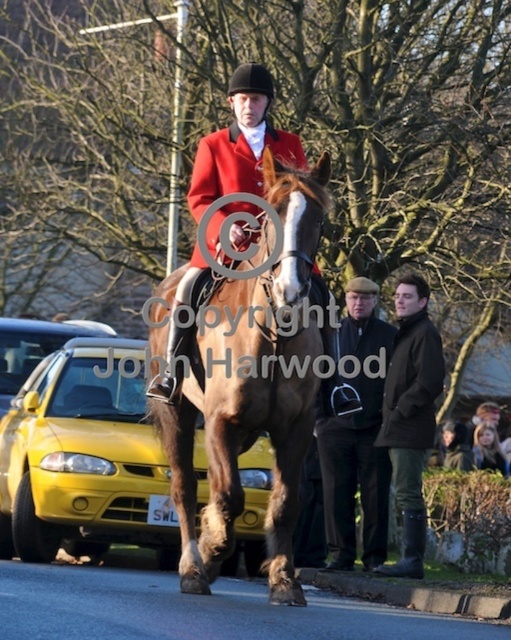
Question: From the image, what is the correct spatial relationship of dark brown leather coat at center in relation to blonde hair at center?

Choices:
 (A) right
 (B) left

Answer: (B)

Question: Which object is closer to the camera taking this photo?

Choices:
 (A) dark brown leather coat at center
 (B) yellow matte taxi at left

Answer: (B)

Question: Can you confirm if brown glossy horse at center is positioned above dark brown leather coat at center?

Choices:
 (A) yes
 (B) no

Answer: (A)

Question: Which of the following is the farthest from the observer?

Choices:
 (A) (48, 476)
 (B) (180, 332)
 (C) (413, 314)
 (D) (264, 356)

Answer: (C)

Question: Which point is closer to the camera taking this photo?

Choices:
 (A) (258, 374)
 (B) (172, 388)
 (C) (439, 364)

Answer: (A)

Question: Can you confirm if dark brown leather coat at center is thinner than matte red jacket at center?

Choices:
 (A) no
 (B) yes

Answer: (B)